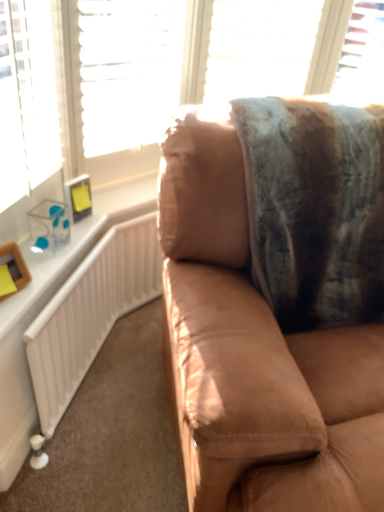
Question: Would you say white textured blind at upper center contains white glossy radiator at left?

Choices:
 (A) yes
 (B) no

Answer: (B)

Question: From a real-world perspective, is white textured blind at upper center beneath white glossy radiator at left?

Choices:
 (A) no
 (B) yes

Answer: (A)

Question: Is white textured blind at upper center taller than white glossy radiator at left?

Choices:
 (A) yes
 (B) no

Answer: (B)

Question: Is white textured blind at upper center completely or partially outside of white glossy radiator at left?

Choices:
 (A) yes
 (B) no

Answer: (A)

Question: Are white textured blind at upper center and white glossy radiator at left beside each other?

Choices:
 (A) no
 (B) yes

Answer: (A)

Question: Is white glossy radiator at left bigger or smaller than transparent plastic window at upper right?

Choices:
 (A) small
 (B) big

Answer: (A)

Question: Do you think white glossy radiator at left is within transparent plastic window at upper right, or outside of it?

Choices:
 (A) outside
 (B) inside

Answer: (A)

Question: Is white glossy radiator at left to the left or to the right of transparent plastic window at upper right in the image?

Choices:
 (A) left
 (B) right

Answer: (A)

Question: Looking at their shapes, would you say white glossy radiator at left is wider or thinner than transparent plastic window at upper right?

Choices:
 (A) thin
 (B) wide

Answer: (A)

Question: Is point (29, 311) positioned closer to the camera than point (274, 278)?

Choices:
 (A) farther
 (B) closer

Answer: (B)

Question: Considering the positions of white glossy radiator at left and suede brown couch at center in the image, is white glossy radiator at left taller or shorter than suede brown couch at center?

Choices:
 (A) short
 (B) tall

Answer: (A)

Question: Is white glossy radiator at left wider or thinner than suede brown couch at center?

Choices:
 (A) wide
 (B) thin

Answer: (B)

Question: In the image, is white glossy radiator at left on the left side or the right side of suede brown couch at center?

Choices:
 (A) right
 (B) left

Answer: (B)

Question: From their relative heights in the image, would you say white textured blind at upper center is taller or shorter than transparent plastic window at upper right?

Choices:
 (A) short
 (B) tall

Answer: (B)

Question: Is point (216, 76) positioned closer to the camera than point (360, 25)?

Choices:
 (A) closer
 (B) farther

Answer: (A)